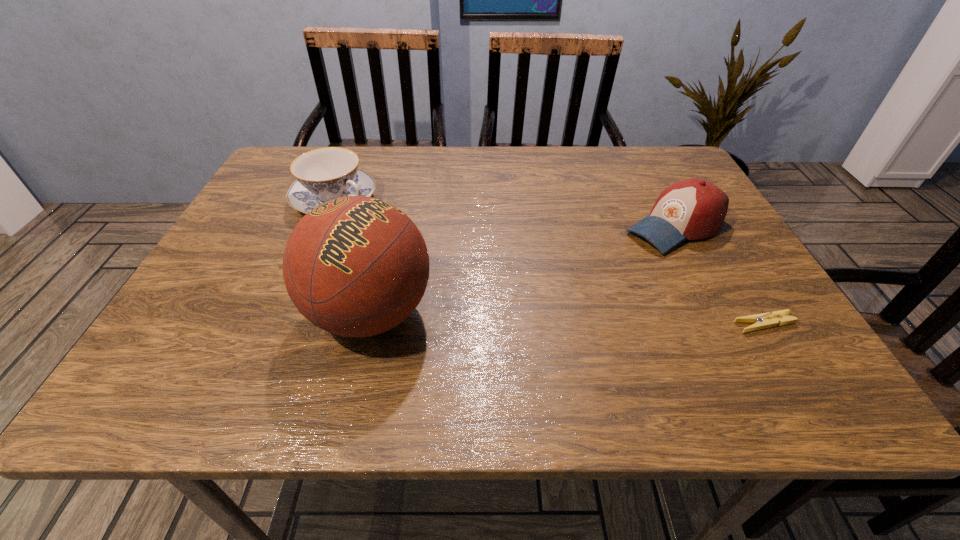
You are a GUI agent. You are given a task and a screenshot of the screen. Output one action in this format:
    pyautogui.click(x=<x>, y=<y>)
    Task: Click on the free location at the far edge of the desktop
    
    Given the screenshot: What is the action you would take?
    pyautogui.click(x=598, y=171)

Identify the location of vacant space at the near edge. Image resolution: width=960 pixels, height=540 pixels. (564, 346).

In the image, there is a desktop. Where is `free space at the left edge`? The width and height of the screenshot is (960, 540). free space at the left edge is located at coordinates (259, 215).

Identify the location of free space at the right edge of the desktop. The height and width of the screenshot is (540, 960). (702, 281).

Find the location of a particular element. The width and height of the screenshot is (960, 540). free space at the near left corner is located at coordinates (225, 346).

Find the location of a particular element. Image resolution: width=960 pixels, height=540 pixels. vacant space at the far right corner of the desktop is located at coordinates (652, 161).

Find the location of `vacant space at the near right corner of the desktop`. vacant space at the near right corner of the desktop is located at coordinates (779, 332).

This screenshot has width=960, height=540. I want to click on empty location between the clothespin and the chinaware, so click(549, 262).

This screenshot has width=960, height=540. In order to click on free spot between the shortest object and the tallest object in this screenshot , I will do `click(567, 319)`.

The image size is (960, 540). Find the location of `free space between the chinaware and the baseball cap`. free space between the chinaware and the baseball cap is located at coordinates (505, 214).